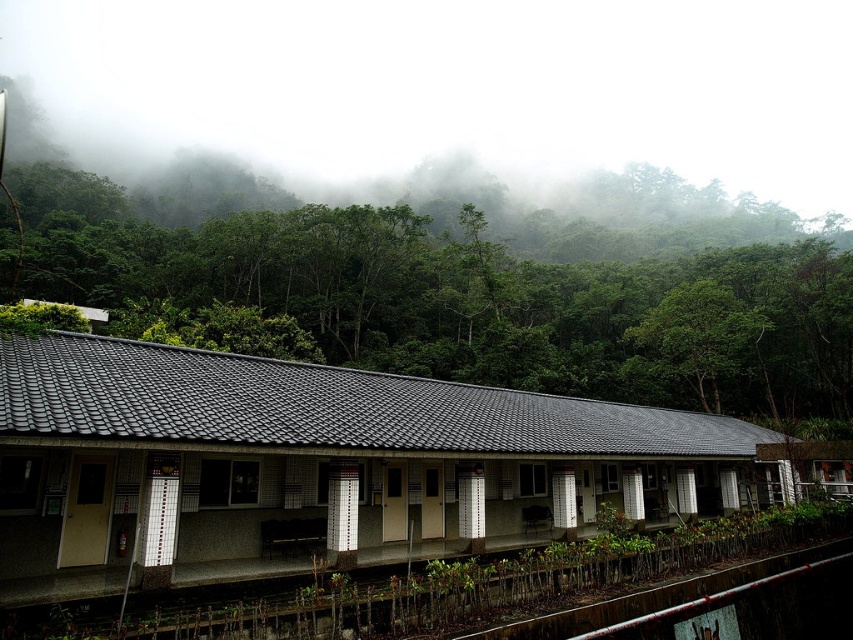
Does point (155, 266) come in front of point (679, 305)?

That is False.

Which is more to the left, green leafy tree at center or green leafy tree at upper center?

From the viewer's perspective, green leafy tree at center appears more on the left side.

What do you see at coordinates (457, 298) in the screenshot?
I see `green leafy tree at center` at bounding box center [457, 298].

The width and height of the screenshot is (853, 640). In order to click on green leafy tree at center in this screenshot , I will do `click(457, 298)`.

Between white fog at upper center and white tile railway station at center, which one has less height?

white tile railway station at center is shorter.

Which is more to the right, white fog at upper center or white tile railway station at center?

Positioned to the right is white fog at upper center.

The height and width of the screenshot is (640, 853). Find the location of `white fog at upper center`. white fog at upper center is located at coordinates (451, 88).

Who is lower down, white tile railway station at center or metallic pipe at lower right?

metallic pipe at lower right is lower down.

Image resolution: width=853 pixels, height=640 pixels. What do you see at coordinates (315, 465) in the screenshot?
I see `white tile railway station at center` at bounding box center [315, 465].

The image size is (853, 640). I want to click on white tile railway station at center, so click(x=315, y=465).